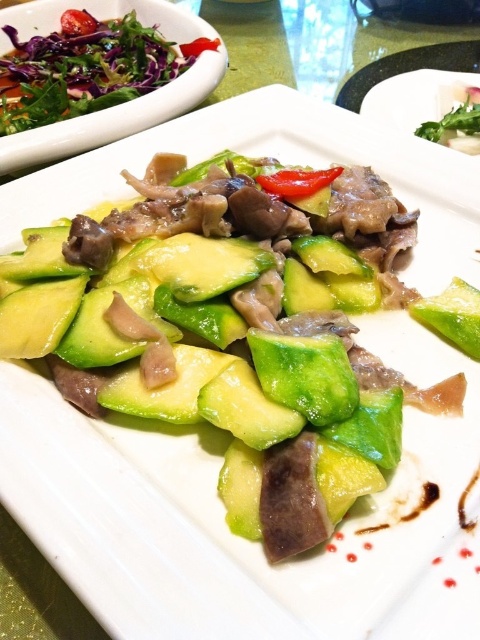
What are the coordinates of the fresh green salad at upper left on the plate?

The fresh green salad at upper left is located at coordinates point (86, 67).

You are a food critic analyzing the dish. The fresh green salad at upper left and the green leafy salad at upper left are both present. Which one is wider?

The fresh green salad at upper left is wider than the green leafy salad at upper left according to the description provided.

You are a food critic analyzing the dish. You notice two salads at the upper left corner of the plate. How far apart are the fresh green salad at upper left and the green leafy salad at upper left from each other?

The fresh green salad at upper left is 35.68 inches from the green leafy salad at upper left.